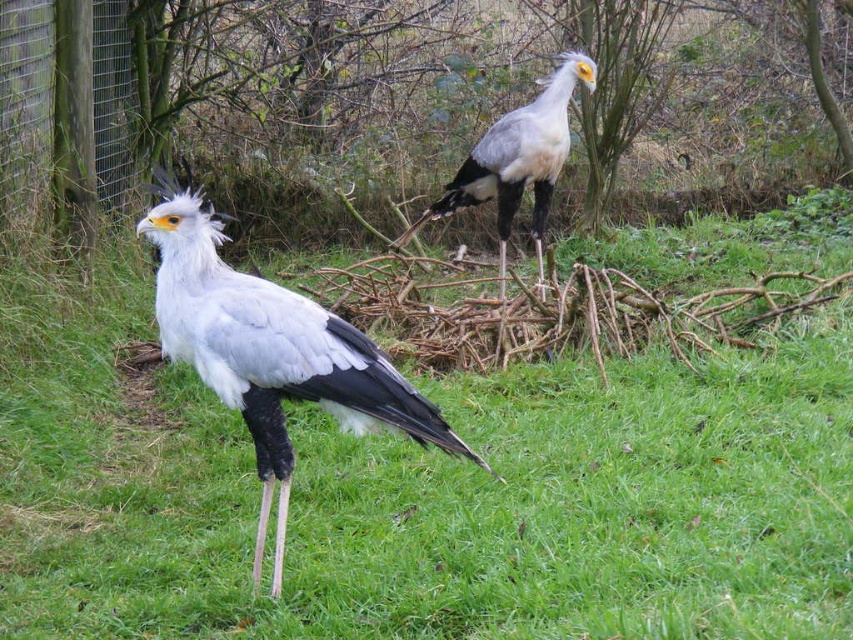
Question: Is green grass at center in front of white matte bird at upper center?

Choices:
 (A) yes
 (B) no

Answer: (A)

Question: Can you confirm if white matte bird at center is positioned below white matte bird at upper center?

Choices:
 (A) no
 (B) yes

Answer: (B)

Question: Which of the following is the farthest from the observer?

Choices:
 (A) white matte bird at center
 (B) green grass at center

Answer: (A)

Question: Is the position of green grass at center more distant than that of white matte bird at center?

Choices:
 (A) yes
 (B) no

Answer: (B)

Question: Considering the real-world distances, which object is closest to the white matte bird at center?

Choices:
 (A) green grass at center
 (B) white matte bird at upper center

Answer: (A)

Question: Which object is closer to the camera taking this photo?

Choices:
 (A) white matte bird at center
 (B) green grass at center

Answer: (B)